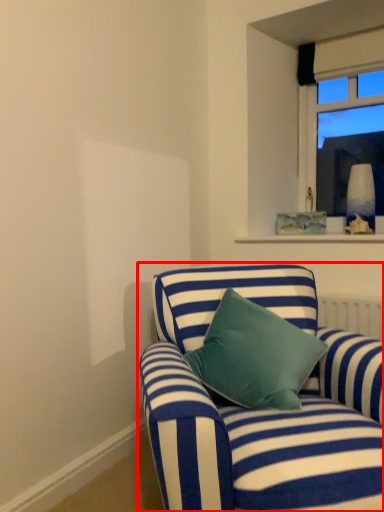
Question: Where is studio couch (annotated by the red box) located in relation to window in the image?

Choices:
 (A) left
 (B) right

Answer: (A)